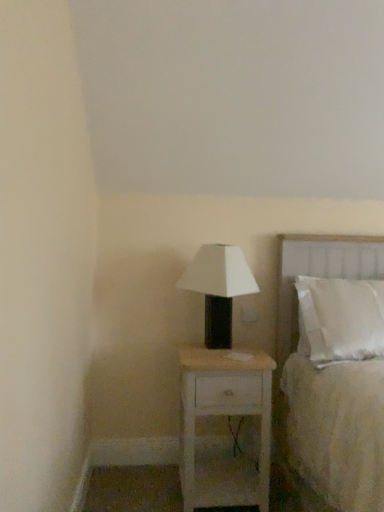
Question: Does white fabric bed at right have a greater width compared to white wood nightstand at center?

Choices:
 (A) no
 (B) yes

Answer: (A)

Question: Is white fabric bed at right smaller than white wood nightstand at center?

Choices:
 (A) yes
 (B) no

Answer: (B)

Question: Is white fabric bed at right looking in the opposite direction of white wood nightstand at center?

Choices:
 (A) yes
 (B) no

Answer: (B)

Question: Does white fabric bed at right have a lesser width compared to white wood nightstand at center?

Choices:
 (A) yes
 (B) no

Answer: (A)

Question: Is white fabric bed at right not close to white wood nightstand at center?

Choices:
 (A) yes
 (B) no

Answer: (B)

Question: From a real-world perspective, is white fabric bed at right located higher than white wood nightstand at center?

Choices:
 (A) no
 (B) yes

Answer: (B)

Question: Is white matte table lamp at center at the right side of white wood nightstand at center?

Choices:
 (A) no
 (B) yes

Answer: (A)

Question: Is white matte table lamp at center located outside white wood nightstand at center?

Choices:
 (A) yes
 (B) no

Answer: (A)

Question: Is white matte table lamp at center at the left side of white wood nightstand at center?

Choices:
 (A) yes
 (B) no

Answer: (A)

Question: Is white wood nightstand at center surrounded by white matte table lamp at center?

Choices:
 (A) yes
 (B) no

Answer: (B)

Question: Does white matte table lamp at center have a greater height compared to white wood nightstand at center?

Choices:
 (A) no
 (B) yes

Answer: (A)

Question: From the image's perspective, would you say white matte table lamp at center is positioned over white wood nightstand at center?

Choices:
 (A) yes
 (B) no

Answer: (A)

Question: Is white wood nightstand at center shorter than white fabric bed at right?

Choices:
 (A) no
 (B) yes

Answer: (B)